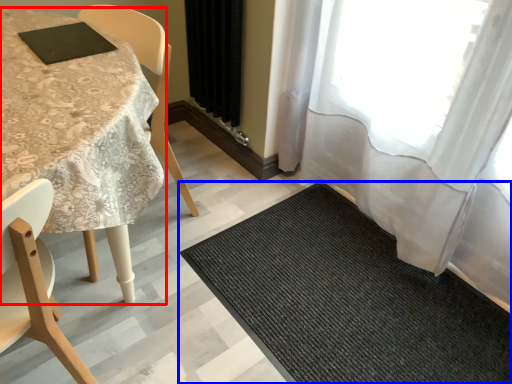
Question: Which object appears farthest to the camera in this image, table (highlighted by a red box) or mat (highlighted by a blue box)?

Choices:
 (A) table
 (B) mat

Answer: (B)